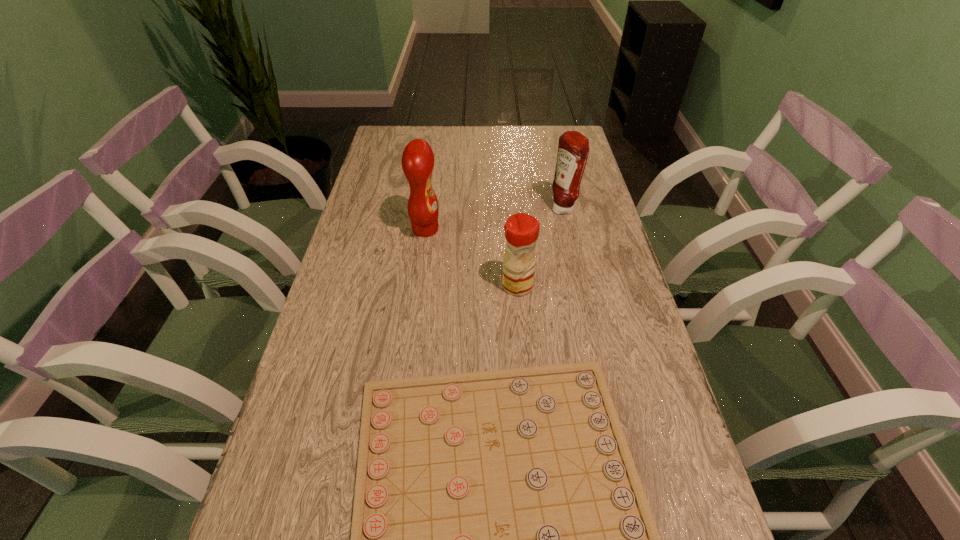
This screenshot has height=540, width=960. What are the coordinates of `vacant space that satisfies the following two spatial constraints: 1. on the label side of the second condiment from right to left; 2. on the right side of the leftmost condiment` in the screenshot? It's located at (418, 286).

What are the coordinates of `free space in the image that satisfies the following two spatial constraints: 1. on the label side of the leftmost condiment; 2. on the right side of the second shortest object` in the screenshot? It's located at (418, 286).

At what (x,y) coordinates should I click in order to perform the action: click on vacant region that satisfies the following two spatial constraints: 1. on the label side of the nearest condiment; 2. on the right side of the leftmost condiment. Please return your answer as a coordinate pair (x, y). This screenshot has width=960, height=540. Looking at the image, I should click on (418, 286).